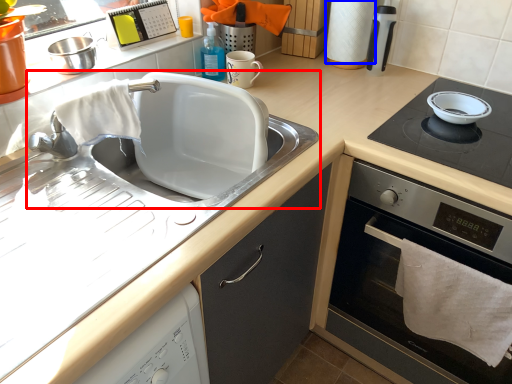
Question: Which point is further to the camera, sink (highlighted by a red box) or paper towel (highlighted by a blue box)?

Choices:
 (A) sink
 (B) paper towel

Answer: (B)